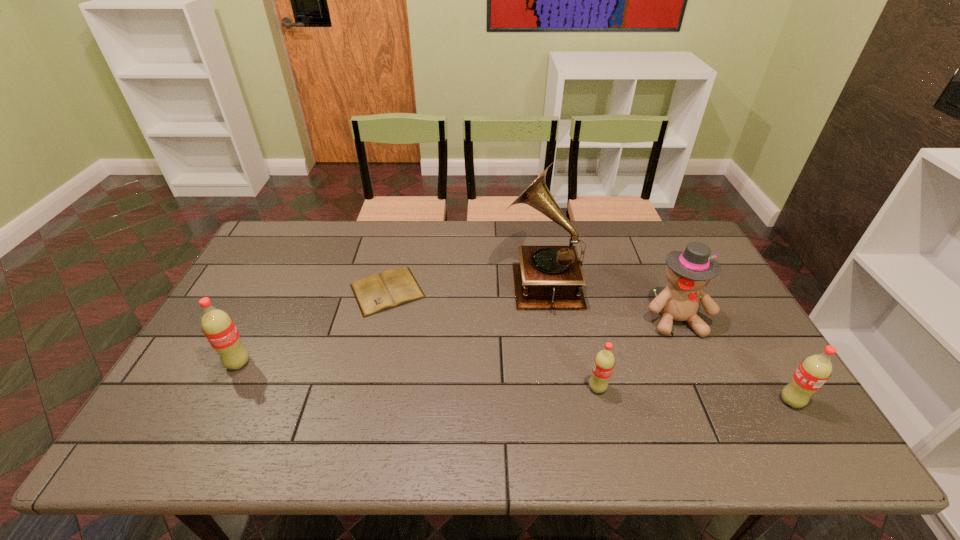
Please point a space for a new pop_(soda) to maintain equal intervals. Please provide its 2D coordinates. Your answer should be formatted as a tuple, i.e. [(x, y)], where the tuple contains the x and y coordinates of a point satisfying the conditions above.

[(413, 375)]